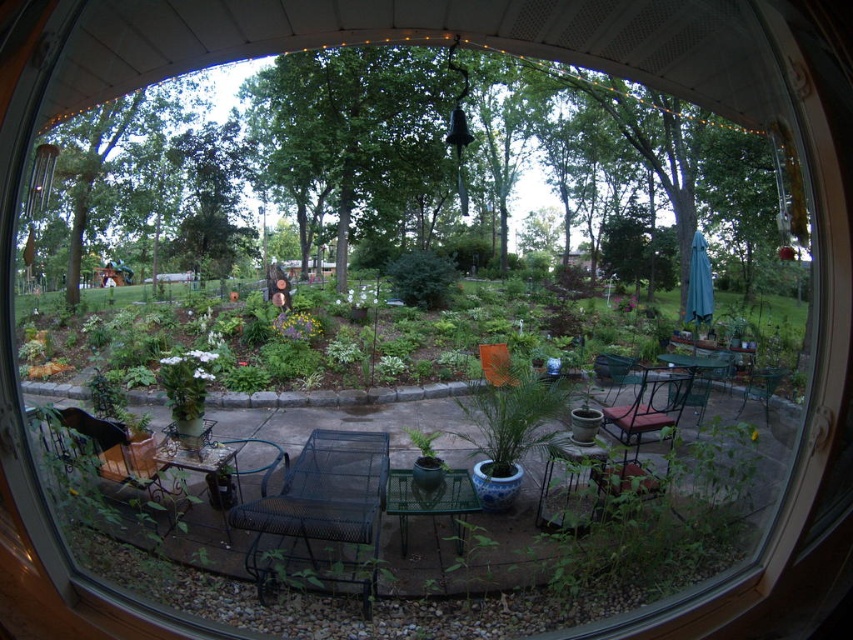
You are standing in front of the circular window frame and want to locate the metallic black chair at lower left. Based on the 2D coordinates provided, where should you look within the window frame to find it?

The metallic black chair at lower left is located at the 2D coordinates point (115, 449) within the window frame.

You are standing in front of the circular window frame looking at the outdoor patio. There is a point marked at coordinates (416, 342). What object is located at this point?

The point at (416, 342) corresponds to the green leafy plants at center.